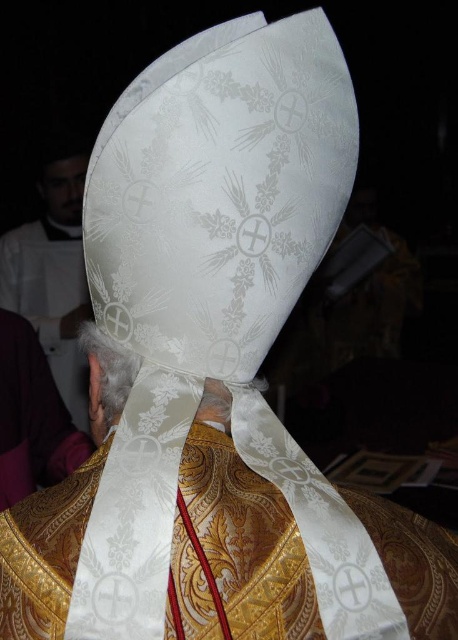
Who is positioned more to the left, white satin headpiece at center or matte black head at upper left?

matte black head at upper left is more to the left.

Based on the photo, is white satin headpiece at center positioned before matte black head at upper left?

Yes.

The width and height of the screenshot is (458, 640). I want to click on white satin headpiece at center, so click(107, 378).

Identify the location of white satin headpiece at center. (107, 378).

Can you confirm if white satin headpiece at center is positioned to the right of white satin headband at center?

Correct, you'll find white satin headpiece at center to the right of white satin headband at center.

Can you confirm if white satin headpiece at center is positioned to the left of white satin headband at center?

Incorrect, white satin headpiece at center is not on the left side of white satin headband at center.

Is point (218, 385) farther from camera compared to point (103, 356)?

No.

At what (x,y) coordinates should I click in order to perform the action: click on white satin headpiece at center. Please return your answer as a coordinate pair (x, y). Image resolution: width=458 pixels, height=640 pixels. Looking at the image, I should click on (107, 378).

Based on the photo, between white silk vestment at upper left and matte black head at upper left, which one has more height?

Standing taller between the two is white silk vestment at upper left.

This screenshot has width=458, height=640. What do you see at coordinates (53, 276) in the screenshot? I see `white silk vestment at upper left` at bounding box center [53, 276].

Is point (64, 385) more distant than point (64, 205)?

No, it is not.

Identify the location of white silk vestment at upper left. (53, 276).